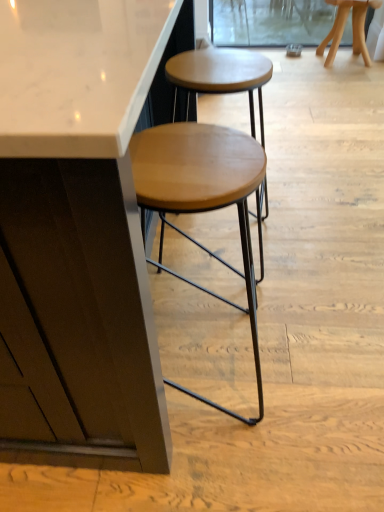
In order to face wooden stool at upper right, the 1th stool when ordered from right to left, should I rotate leftwards or rightwards?

You should look right and rotate roughly 20.019 degrees.

This screenshot has width=384, height=512. Identify the location of wooden stool at upper right, which is counted as the first stool, starting from the top. (352, 28).

Is wooden seat at center, the second stool in the right-to-left sequence, positioned with its back to transparent glass screen door at upper center?

No, transparent glass screen door at upper center is not at the back of wooden seat at center, the second stool in the right-to-left sequence.

Which is in front, point (243, 178) or point (222, 30)?

Positioned in front is point (243, 178).

Is wooden seat at center, the first stool ordered from the bottom, positioned beyond the bounds of transparent glass screen door at upper center?

Indeed, wooden seat at center, the first stool ordered from the bottom, is completely outside transparent glass screen door at upper center.

In terms of width, does wooden seat at center, the second stool in the back-to-front sequence, look wider or thinner when compared to transparent glass screen door at upper center?

Clearly, wooden seat at center, the second stool in the back-to-front sequence, has more width compared to transparent glass screen door at upper center.

From a real-world perspective, is wooden stool at upper right, which is the second stool from left to right, over transparent glass screen door at upper center?

Correct, in the physical world, wooden stool at upper right, which is the second stool from left to right, is higher than transparent glass screen door at upper center.

Identify the location of stool located on the right of transparent glass screen door at upper center. The height and width of the screenshot is (512, 384). click(352, 28).

From the image's perspective, which is above, wooden stool at upper right, placed as the 2th stool when sorted from front to back, or transparent glass screen door at upper center?

transparent glass screen door at upper center appears higher in the image.

In the scene shown: Can you confirm if transparent glass screen door at upper center is smaller than wooden stool at upper right, the first stool in the back-to-front sequence?

Yes.

Considering the relative sizes of transparent glass screen door at upper center and wooden stool at upper right, which is counted as the first stool, starting from the top, in the image provided, is transparent glass screen door at upper center taller than wooden stool at upper right, which is counted as the first stool, starting from the top,?

No.

Is point (270, 22) farther from viewer compared to point (337, 3)?

Yes, it is.

Is transparent glass screen door at upper center in front of wooden stool at upper right, positioned as the second stool in bottom-to-top order?

No.

Would you say wooden seat at center, the second stool in the back-to-front sequence, is part of wooden stool at upper right, the 1th stool when ordered from right to left,'s contents?

No, wooden stool at upper right, the 1th stool when ordered from right to left, does not contain wooden seat at center, the second stool in the back-to-front sequence.

Which of these two, wooden stool at upper right, positioned as the second stool in bottom-to-top order, or wooden seat at center, the first stool ordered from the bottom, is smaller?

Smaller between the two is wooden stool at upper right, positioned as the second stool in bottom-to-top order.

Between point (318, 55) and point (183, 188), which one is positioned in front?

The point (183, 188) is more forward.

Where is `the 2nd stool located above the transparent glass screen door at upper center (from a real-world perspective)`? The image size is (384, 512). the 2nd stool located above the transparent glass screen door at upper center (from a real-world perspective) is located at coordinates (201, 198).

Could you tell me if transparent glass screen door at upper center is turned towards wooden seat at center, the first stool in the front-to-back sequence?

Yes, transparent glass screen door at upper center is oriented towards wooden seat at center, the first stool in the front-to-back sequence.

Could wooden seat at center, the second stool in the back-to-front sequence, be considered to be inside transparent glass screen door at upper center?

No, wooden seat at center, the second stool in the back-to-front sequence, is not inside transparent glass screen door at upper center.

Is point (241, 46) closer to camera compared to point (245, 254)?

No.

Is wooden seat at center, acting as the second stool starting from the top, turned away from wooden stool at upper right, the 1th stool when ordered from right to left?

wooden seat at center, acting as the second stool starting from the top, does not have its back to wooden stool at upper right, the 1th stool when ordered from right to left.

Can you tell me how much wooden seat at center, the second stool in the back-to-front sequence, and wooden stool at upper right, the 1th stool when ordered from right to left, differ in facing direction?

They differ by 1.11 degrees in their facing directions.

Does point (146, 202) appear closer or farther from the camera than point (360, 8)?

Point (146, 202) is closer to the camera than point (360, 8).

From a real-world perspective, does wooden seat at center, the first stool in the front-to-back sequence, stand above wooden stool at upper right, which is the second stool from left to right?

Correct, in the physical world, wooden seat at center, the first stool in the front-to-back sequence, is higher than wooden stool at upper right, which is the second stool from left to right.

Where is `screen door on the right of wooden seat at center, acting as the second stool starting from the top`? screen door on the right of wooden seat at center, acting as the second stool starting from the top is located at coordinates (270, 22).

At what (x,y) coordinates should I click in order to perform the action: click on screen door located on the left of wooden stool at upper right, the 1th stool when ordered from right to left. Please return your answer as a coordinate pair (x, y). The image size is (384, 512). Looking at the image, I should click on (270, 22).

In the scene shown: Considering their positions, is wooden seat at center, the first stool in the front-to-back sequence, positioned closer to wooden stool at upper right, which is counted as the first stool, starting from the top, than transparent glass screen door at upper center?

transparent glass screen door at upper center lies closer to wooden stool at upper right, which is counted as the first stool, starting from the top, than the other object.

Considering their positions, is wooden seat at center, the second stool in the right-to-left sequence, positioned further to transparent glass screen door at upper center than wooden stool at upper right, positioned as the second stool in bottom-to-top order?

The object further to transparent glass screen door at upper center is wooden seat at center, the second stool in the right-to-left sequence.

Which object lies further to the anchor point wooden stool at upper right, which is counted as the first stool, starting from the top, transparent glass screen door at upper center or wooden seat at center, the first stool in the front-to-back sequence?

wooden seat at center, the first stool in the front-to-back sequence.

Based on their spatial positions, is wooden stool at upper right, which is counted as the first stool, starting from the top, or transparent glass screen door at upper center closer to wooden seat at center, the 1th stool from the left?

The object closer to wooden seat at center, the 1th stool from the left, is wooden stool at upper right, which is counted as the first stool, starting from the top.

Based on their spatial positions, is wooden stool at upper right, the first stool in the back-to-front sequence, or wooden seat at center, the first stool ordered from the bottom, closer to transparent glass screen door at upper center?

Based on the image, wooden stool at upper right, the first stool in the back-to-front sequence, appears to be nearer to transparent glass screen door at upper center.

Considering their positions, is transparent glass screen door at upper center positioned further to wooden seat at center, the first stool ordered from the bottom, than wooden stool at upper right, positioned as the second stool in bottom-to-top order?

transparent glass screen door at upper center lies further to wooden seat at center, the first stool ordered from the bottom, than the other object.

At what (x,y) coordinates should I click in order to perform the action: click on stool between wooden seat at center, acting as the second stool starting from the top, and transparent glass screen door at upper center in the front-back direction. Please return your answer as a coordinate pair (x, y). Looking at the image, I should click on (352, 28).